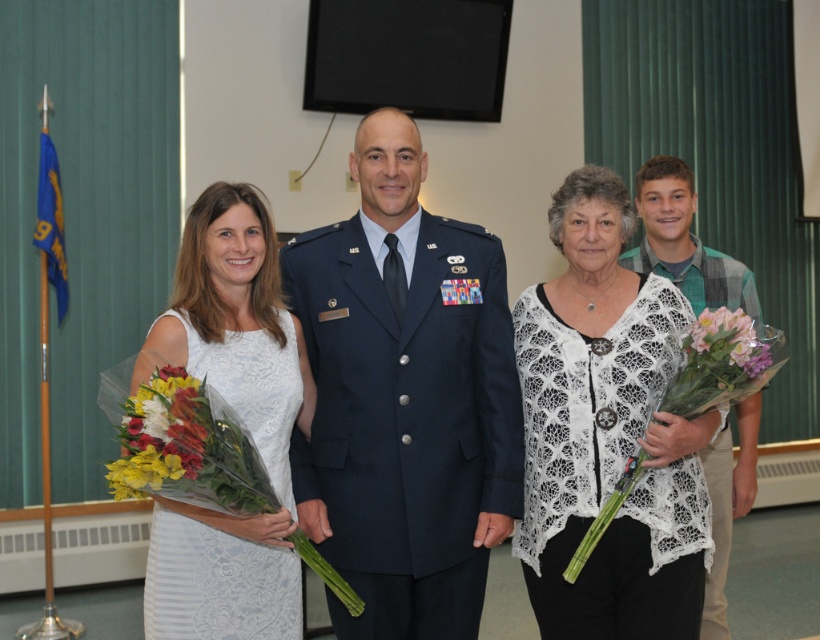
Who is positioned more to the right, white lace cardigan at center or pink floral bouquet at center?

Positioned to the right is pink floral bouquet at center.

Does white lace cardigan at center appear under pink floral bouquet at center?

Yes.

The height and width of the screenshot is (640, 820). I want to click on white lace cardigan at center, so click(x=606, y=433).

Locate an element on the screen. The height and width of the screenshot is (640, 820). white lace cardigan at center is located at coordinates (606, 433).

Does white lace dress at left have a lesser height compared to glossy floral bouquet at left?

No, white lace dress at left is not shorter than glossy floral bouquet at left.

Who is positioned more to the right, white lace dress at left or glossy floral bouquet at left?

white lace dress at left

Is point (597, 225) closer to viewer compared to point (137, 392)?

No, (597, 225) is further to viewer.

In order to click on white lace dress at left in this screenshot , I will do `click(595, 256)`.

Based on the photo, is white lace dress at center smaller than glossy floral bouquet at left?

No, white lace dress at center is not smaller than glossy floral bouquet at left.

Does white lace dress at center lie behind glossy floral bouquet at left?

Yes, white lace dress at center is further from the viewer.

Between point (257, 564) and point (188, 426), which one is positioned in front?

Point (188, 426) is more forward.

I want to click on white lace dress at center, so click(240, 419).